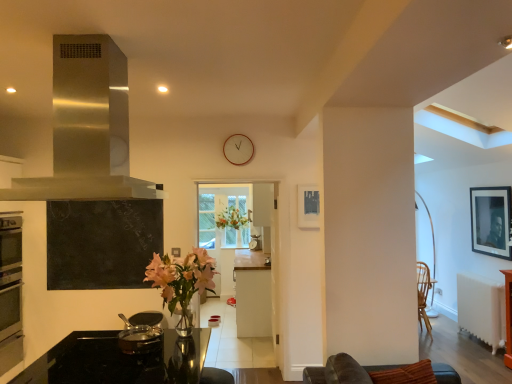
Question: Looking at the image, does shiny metallic pot at lower left seem bigger or smaller compared to white matte cabinet at center?

Choices:
 (A) big
 (B) small

Answer: (B)

Question: Choose the correct answer: Is shiny metallic pot at lower left inside white matte cabinet at center or outside it?

Choices:
 (A) outside
 (B) inside

Answer: (A)

Question: Which object is the farthest from the pink glass vase at center?

Choices:
 (A) stainless steel exhaust hood at upper left
 (B) white matte cabinet at center
 (C) black matte picture frame at upper right, which appears as the 1th picture frame when viewed from the right
 (D) shiny metallic pot at lower left
 (E) wooden clock at center

Answer: (C)

Question: Estimate the real-world distances between objects in this image. Which object is farther from the black matte picture frame at upper right, positioned as the 2th picture frame in left-to-right order?

Choices:
 (A) pink glass vase at center
 (B) stainless steel exhaust hood at upper left
 (C) white matte cabinet at center
 (D) brown leather couch at lower right
 (E) wooden clock at center

Answer: (B)